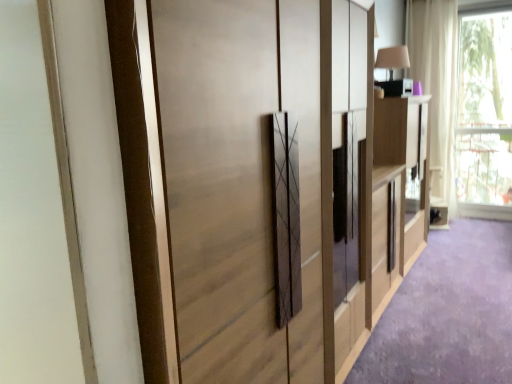
Question: Is matte wood cupboard at center located outside light wood cabinet at right?

Choices:
 (A) yes
 (B) no

Answer: (A)

Question: Does matte wood cupboard at center have a lesser height compared to light wood cabinet at right?

Choices:
 (A) yes
 (B) no

Answer: (B)

Question: Does matte wood cupboard at center have a smaller size compared to light wood cabinet at right?

Choices:
 (A) yes
 (B) no

Answer: (B)

Question: From the image's perspective, is matte wood cupboard at center on top of light wood cabinet at right?

Choices:
 (A) no
 (B) yes

Answer: (A)

Question: Would you say matte wood cupboard at center is a long distance from light wood cabinet at right?

Choices:
 (A) yes
 (B) no

Answer: (B)

Question: From the image's perspective, is white sheer curtain at upper right positioned above or below matte wood cupboard at center?

Choices:
 (A) above
 (B) below

Answer: (A)

Question: Which is correct: white sheer curtain at upper right is inside matte wood cupboard at center, or outside of it?

Choices:
 (A) inside
 (B) outside

Answer: (B)

Question: In terms of width, does white sheer curtain at upper right look wider or thinner when compared to matte wood cupboard at center?

Choices:
 (A) wide
 (B) thin

Answer: (B)

Question: Relative to matte wood cupboard at center, is white sheer curtain at upper right in front or behind?

Choices:
 (A) behind
 (B) front

Answer: (A)

Question: From their relative heights in the image, would you say matte wood cupboard at center is taller or shorter than matte beige table lamp at upper right?

Choices:
 (A) tall
 (B) short

Answer: (A)

Question: Would you say matte wood cupboard at center is inside or outside matte beige table lamp at upper right?

Choices:
 (A) inside
 (B) outside

Answer: (B)

Question: From the image's perspective, is matte wood cupboard at center positioned above or below matte beige table lamp at upper right?

Choices:
 (A) below
 (B) above

Answer: (A)

Question: Considering the positions of point (160, 16) and point (380, 59), is point (160, 16) closer or farther from the camera than point (380, 59)?

Choices:
 (A) farther
 (B) closer

Answer: (B)

Question: Is transparent glass window at upper right to the left or to the right of white sheer curtain at upper right in the image?

Choices:
 (A) left
 (B) right

Answer: (B)

Question: In the image, is transparent glass window at upper right positioned in front of or behind white sheer curtain at upper right?

Choices:
 (A) front
 (B) behind

Answer: (A)